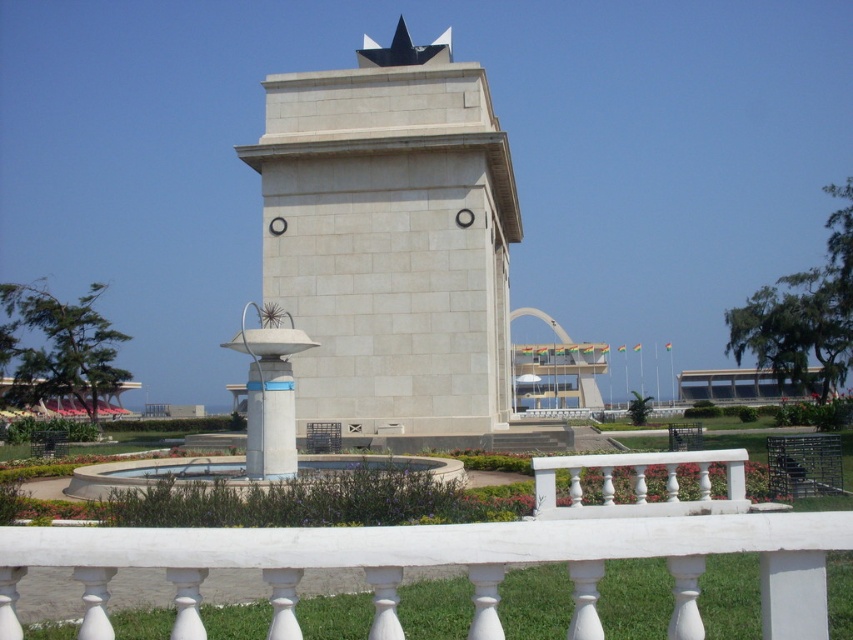
Question: Estimate the real-world distances between objects in this image. Which object is closer to the white stone tower at center?

Choices:
 (A) blue glossy pedestal at center
 (B) white marble balustrade at lower center

Answer: (A)

Question: Considering the relative positions of white stone tower at center and blue glossy pedestal at center in the image provided, where is white stone tower at center located with respect to blue glossy pedestal at center?

Choices:
 (A) left
 (B) right

Answer: (B)

Question: Which point is closer to the camera taking this photo?

Choices:
 (A) (262, 356)
 (B) (759, 602)

Answer: (B)

Question: Which point is farther from the camera taking this photo?

Choices:
 (A) (370, 323)
 (B) (689, 525)

Answer: (A)

Question: Does white stone tower at center come in front of white marble balustrade at lower center?

Choices:
 (A) yes
 (B) no

Answer: (B)

Question: Is white marble balustrade at lower center wider than blue glossy pedestal at center?

Choices:
 (A) yes
 (B) no

Answer: (B)